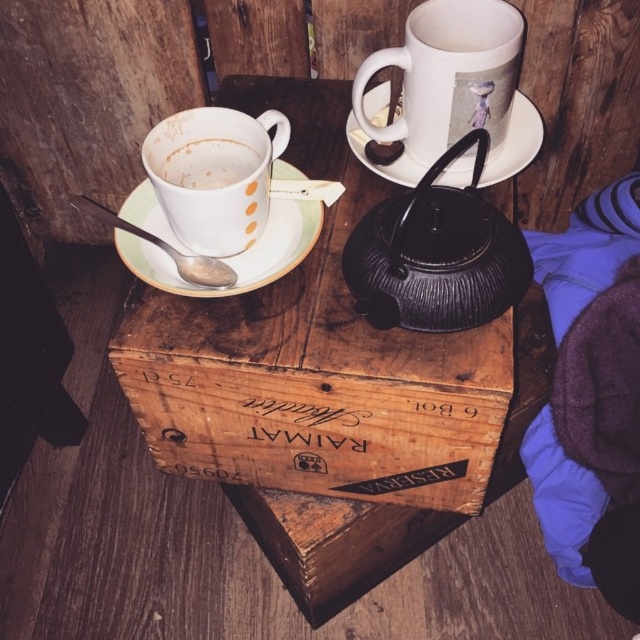
Is wooden crate at center to the right of white ceramic mug at upper center from the viewer's perspective?

In fact, wooden crate at center is to the left of white ceramic mug at upper center.

Between point (324, 324) and point (500, 28), which one is positioned behind?

Positioned behind is point (500, 28).

Locate an element on the screen. The height and width of the screenshot is (640, 640). wooden crate at center is located at coordinates (321, 385).

Based on the photo, is black textured teapot at center wider than white matte cup at upper left?

Indeed, black textured teapot at center has a greater width compared to white matte cup at upper left.

Between black textured teapot at center and white matte cup at upper left, which one is positioned higher?

white matte cup at upper left is above.

Is point (433, 305) positioned before point (176, 170)?

Yes, it is.

At what (x,y) coordinates should I click in order to perform the action: click on black textured teapot at center. Please return your answer as a coordinate pair (x, y). Looking at the image, I should click on click(436, 253).

Between white ceramic mug at upper center and white matte cup at upper left, which one appears on the left side from the viewer's perspective?

white matte cup at upper left

Which is more to the right, white ceramic mug at upper center or white matte cup at upper left?

Positioned to the right is white ceramic mug at upper center.

Which is behind, point (403, 80) or point (220, 150)?

Positioned behind is point (403, 80).

Find the location of `white ceramic mug at upper center`. white ceramic mug at upper center is located at coordinates (449, 76).